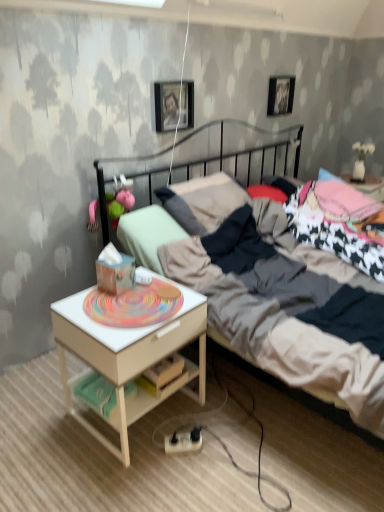
This screenshot has height=512, width=384. I want to click on vacant area that lies to the right of white wood nightstand at lower left, so click(238, 422).